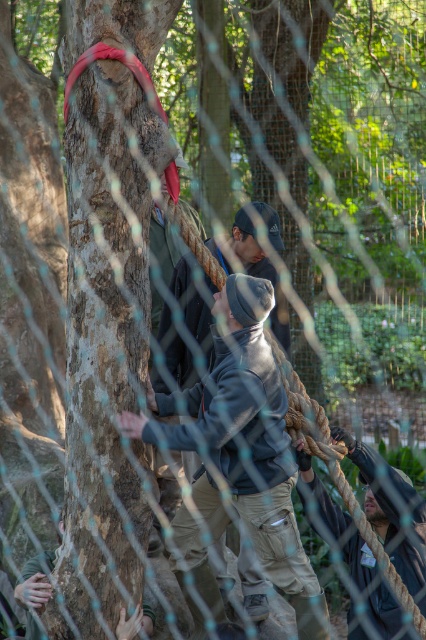
Question: Can you confirm if gray fleece jacket at center is positioned to the left of dark gray fabric at lower right?

Choices:
 (A) yes
 (B) no

Answer: (A)

Question: Which point is closer to the camera taking this photo?

Choices:
 (A) (368, 468)
 (B) (319, 604)

Answer: (A)

Question: Among these points, which one is farthest from the camera?

Choices:
 (A) (385, 490)
 (B) (259, 560)

Answer: (B)

Question: Is gray fleece jacket at center to the left of dark gray fabric at lower right from the viewer's perspective?

Choices:
 (A) no
 (B) yes

Answer: (B)

Question: Can you confirm if gray fleece jacket at center is positioned below dark gray fabric at lower right?

Choices:
 (A) yes
 (B) no

Answer: (B)